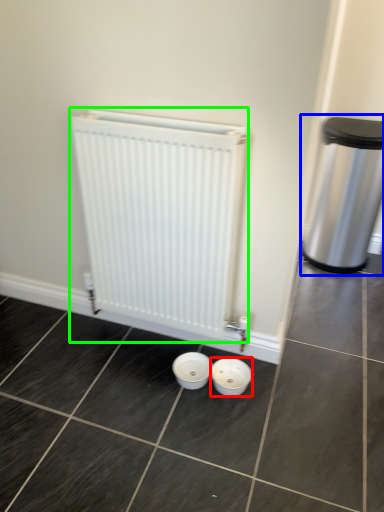
Question: Which is nearer to the basin (highlighted by a red box)? waste container (highlighted by a blue box) or radiator (highlighted by a green box).

Choices:
 (A) waste container
 (B) radiator

Answer: (B)